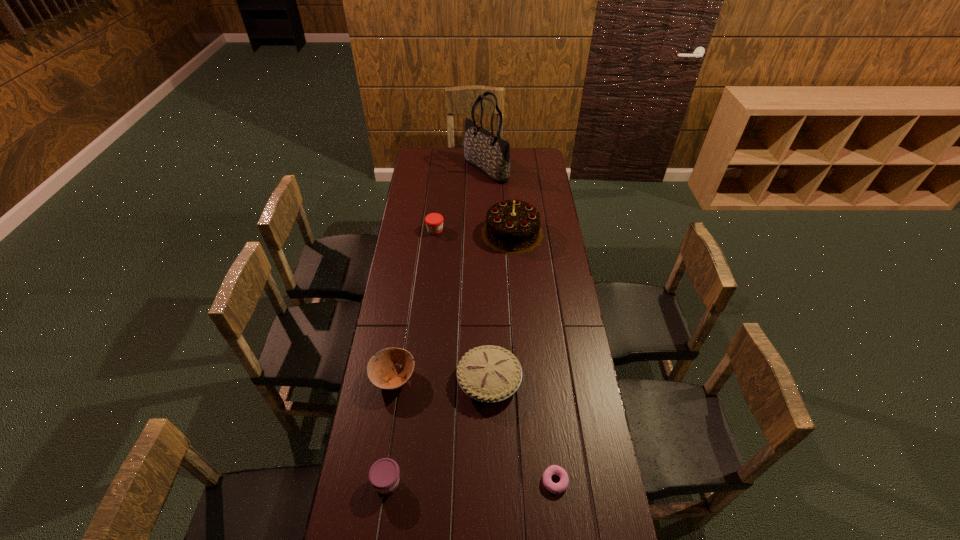
The width and height of the screenshot is (960, 540). I want to click on vacant space at the left edge of the desktop, so click(393, 301).

In the image, there is a desktop. Where is `vacant space at the right edge`? The width and height of the screenshot is (960, 540). vacant space at the right edge is located at coordinates (564, 352).

This screenshot has height=540, width=960. I want to click on blank region between the bowl and the farther jam, so click(415, 304).

Identify the location of free space that is in between the second tallest object and the pie. (501, 307).

This screenshot has width=960, height=540. I want to click on vacant area that lies between the bowl and the nearer jam, so click(x=391, y=430).

Locate an element on the screen. This screenshot has width=960, height=540. free space between the bowl and the pie is located at coordinates 442,379.

Locate an element on the screen. This screenshot has width=960, height=540. free space between the farther jam and the tote bag is located at coordinates (461, 200).

At what (x,y) coordinates should I click in order to perform the action: click on unoccupied area between the tallest object and the nearer jam. Please return your answer as a coordinate pair (x, y). The image size is (960, 540). Looking at the image, I should click on (437, 326).

The height and width of the screenshot is (540, 960). I want to click on empty space between the second tallest object and the pie, so (x=501, y=307).

Locate an element on the screen. The height and width of the screenshot is (540, 960). empty space between the pie and the bowl is located at coordinates (442, 379).